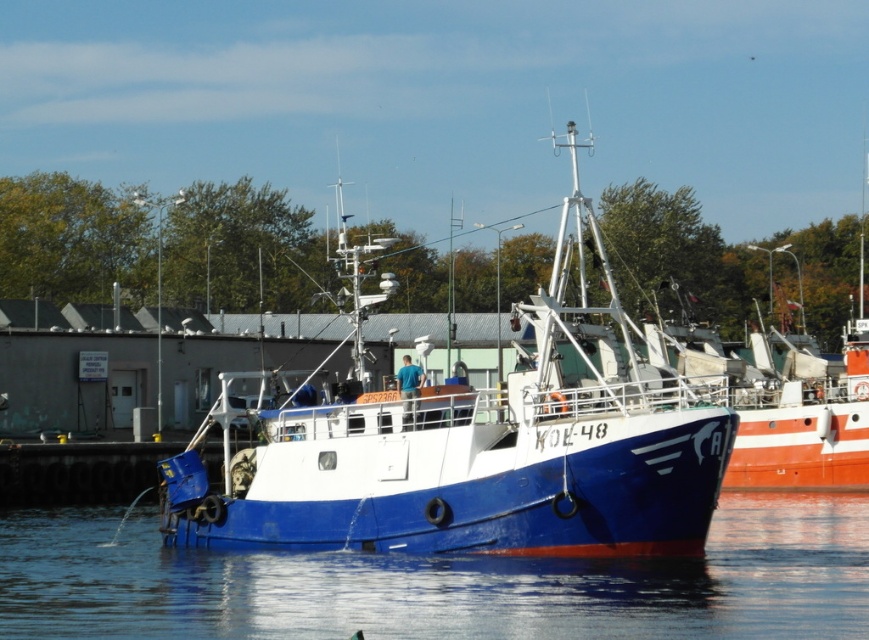
Question: Among these objects, which one is farthest from the camera?

Choices:
 (A) blue water at lower center
 (B) blue matte boat at center

Answer: (B)

Question: Which point appears closest to the camera in this image?

Choices:
 (A) (542, 577)
 (B) (327, 513)

Answer: (A)

Question: Observing the image, what is the correct spatial positioning of blue matte boat at center in reference to blue water at lower center?

Choices:
 (A) right
 (B) left

Answer: (A)

Question: Can you confirm if blue matte boat at center is wider than blue water at lower center?

Choices:
 (A) yes
 (B) no

Answer: (B)

Question: Is blue matte boat at center to the right of blue water at lower center from the viewer's perspective?

Choices:
 (A) no
 (B) yes

Answer: (B)